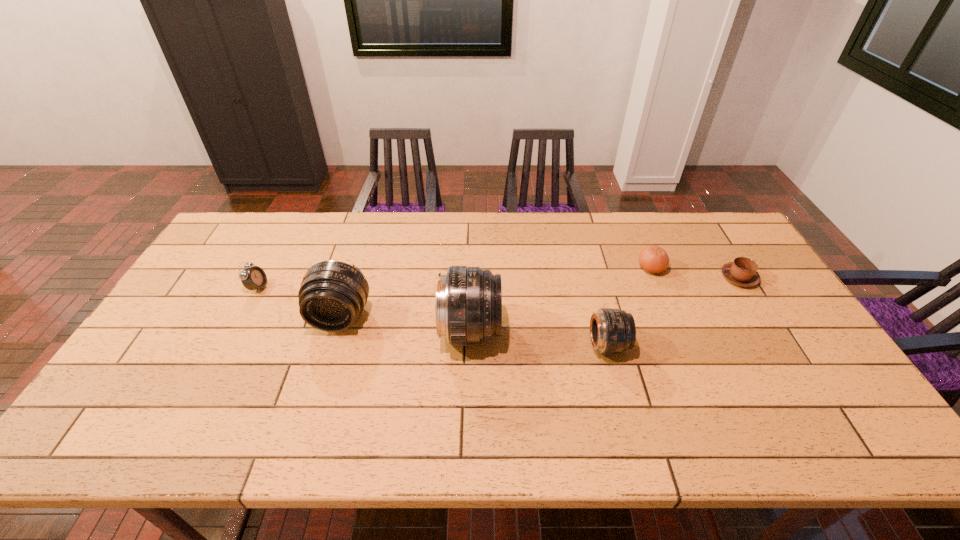
Find the location of a particular element. This screenshot has height=540, width=960. the shortest object is located at coordinates (742, 271).

This screenshot has width=960, height=540. Identify the location of vacant space positioned 0.050m at the front element of the second object from left to right. (330, 351).

Locate an element on the screen. This screenshot has height=540, width=960. vacant space located at the front element of the fourth object from right to left is located at coordinates click(x=521, y=331).

Locate an element on the screen. vacant space located at the front element of the third tallest object is located at coordinates (684, 345).

Find the location of a particular element. This screenshot has width=960, height=540. free spot located on the face of the alarm clock is located at coordinates (375, 287).

Image resolution: width=960 pixels, height=540 pixels. What are the coordinates of `free space located on the front of the fifth tallest object` in the screenshot? It's located at (702, 389).

At what (x,y) coordinates should I click in order to perform the action: click on free space located 0.260m on the side of the rightmost object with the handle. Please return your answer as a coordinate pair (x, y). This screenshot has height=540, width=960. Looking at the image, I should click on (638, 278).

This screenshot has width=960, height=540. Identify the location of free region located on the side of the rightmost object with the handle. (648, 278).

Find the location of `free space located on the side of the rightmost object with the handle`. free space located on the side of the rightmost object with the handle is located at coordinates (702, 278).

Identify the location of object that is at the right edge. (742, 271).